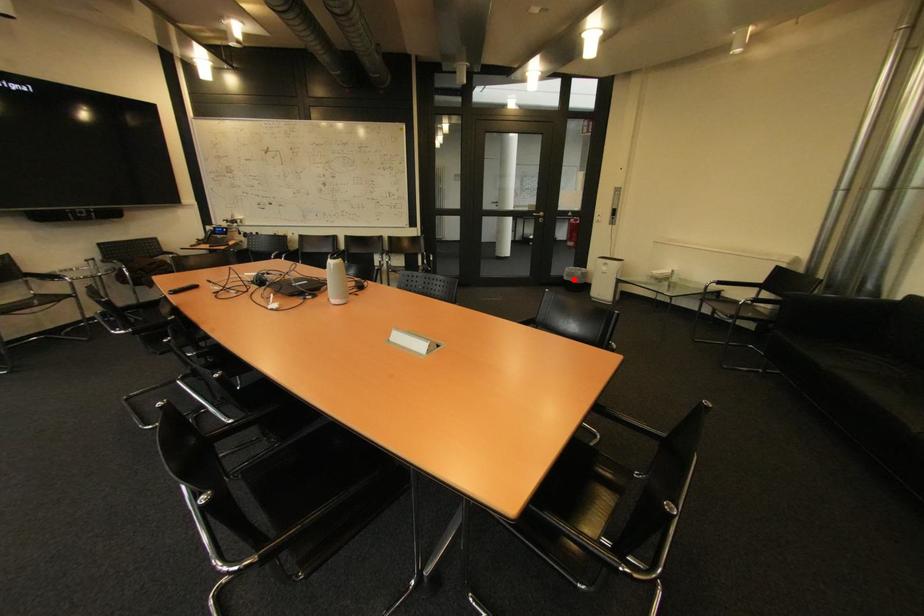
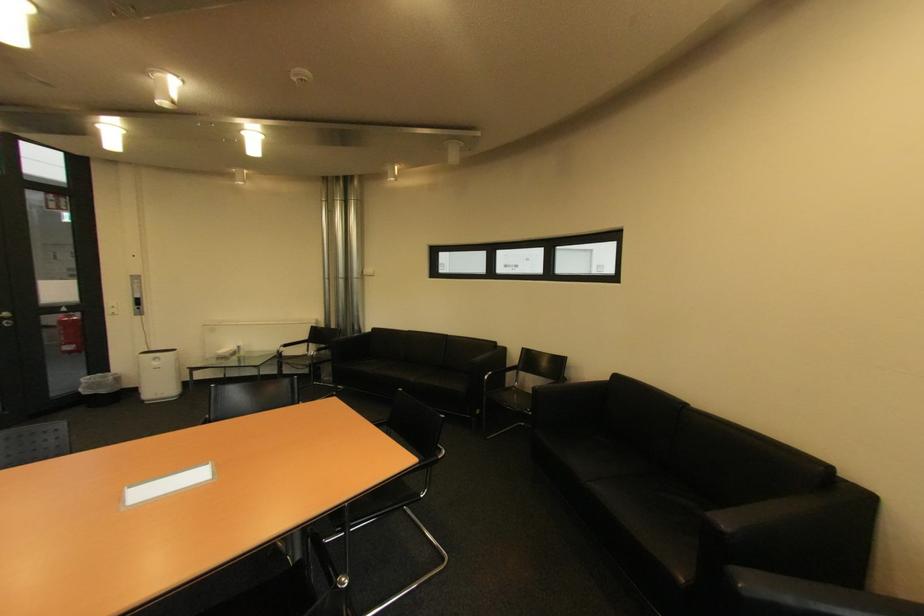
The point at the highlighted location is marked in the first image. Where is the corresponding point in the second image?

(94, 394)